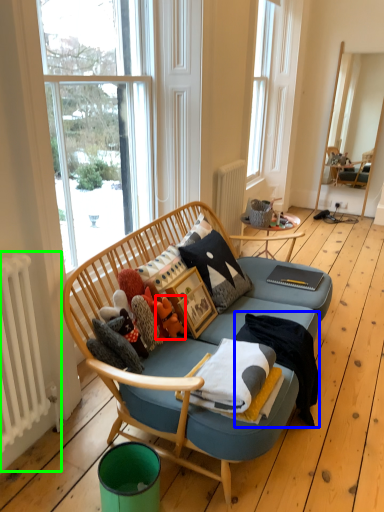
Question: Which object is the farthest from toy (highlighted by a red box)? Choose among these: blanket (highlighted by a blue box) or radiator (highlighted by a green box).

Choices:
 (A) blanket
 (B) radiator

Answer: (B)